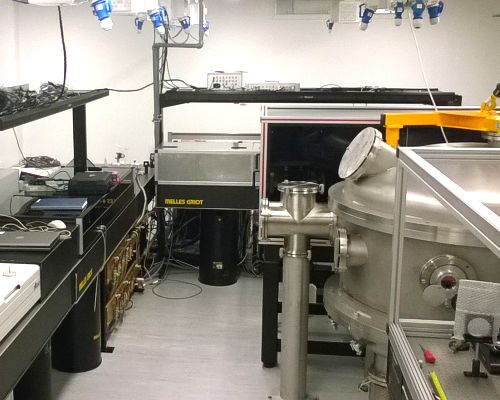
This screenshot has width=500, height=400. I want to click on blue book, so (37, 209).